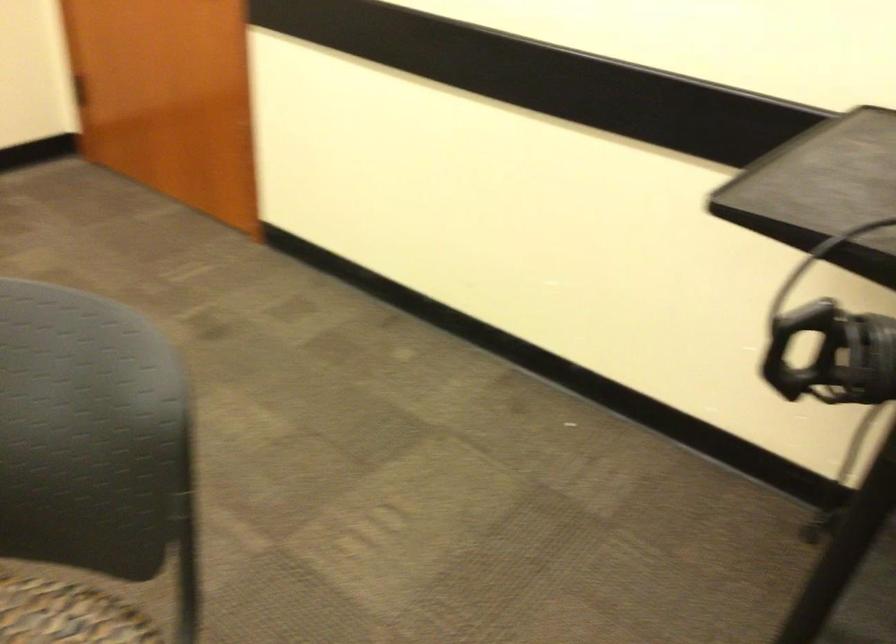
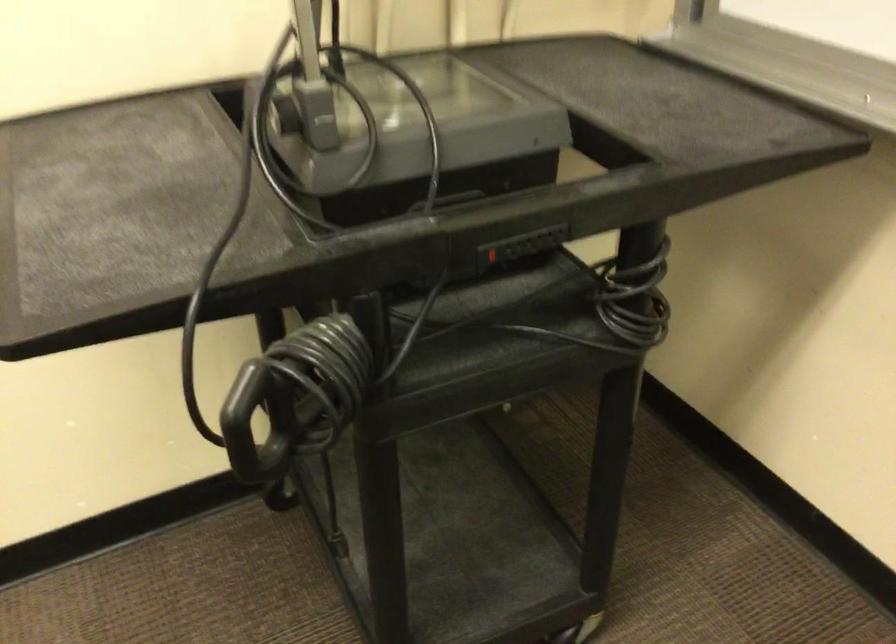
The first image is from the beginning of the video and the second image is from the end. How did the camera likely rotate when shooting the video?

The rotation direction of the camera is right-down.